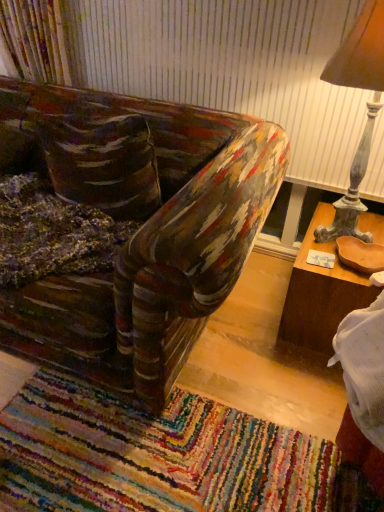
The image size is (384, 512). What are the coordinates of `free point above multicolored woven mat at lower center (from a real-world perspective)` in the screenshot? It's located at (157, 445).